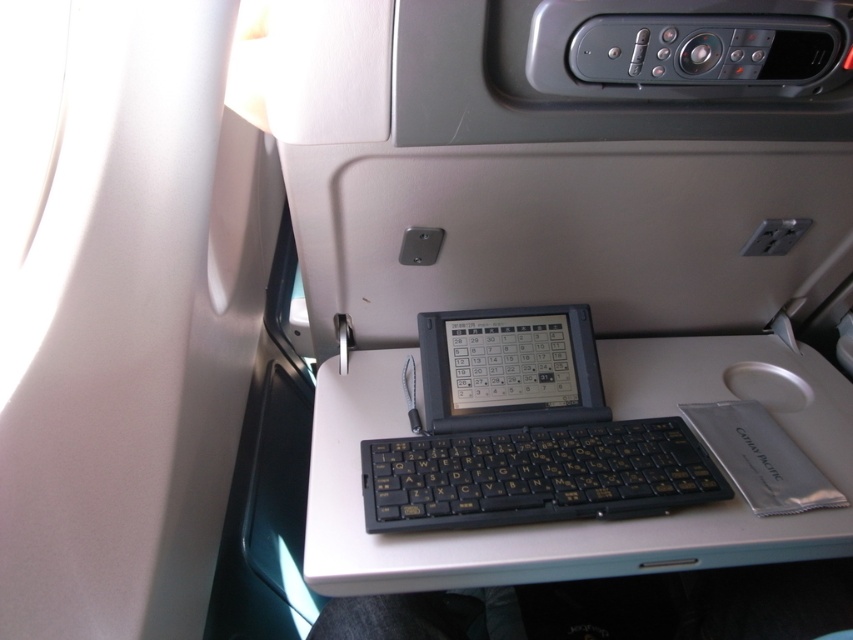
Question: Is white plastic table at center to the left of silver metallic mouse at center from the viewer's perspective?

Choices:
 (A) no
 (B) yes

Answer: (B)

Question: Is black plastic keyboard at center wider than silver metallic mouse at center?

Choices:
 (A) no
 (B) yes

Answer: (B)

Question: Does black plastic keyboard at center appear over silver metallic mouse at center?

Choices:
 (A) no
 (B) yes

Answer: (A)

Question: Among these points, which one is nearest to the camera?

Choices:
 (A) (709, 536)
 (B) (402, 476)

Answer: (A)

Question: Which point appears closest to the camera in this image?

Choices:
 (A) (544, 445)
 (B) (746, 387)
 (C) (685, 563)

Answer: (C)

Question: Which of the following is the farthest from the observer?

Choices:
 (A) black plastic keyboard at center
 (B) white plastic table at center

Answer: (A)